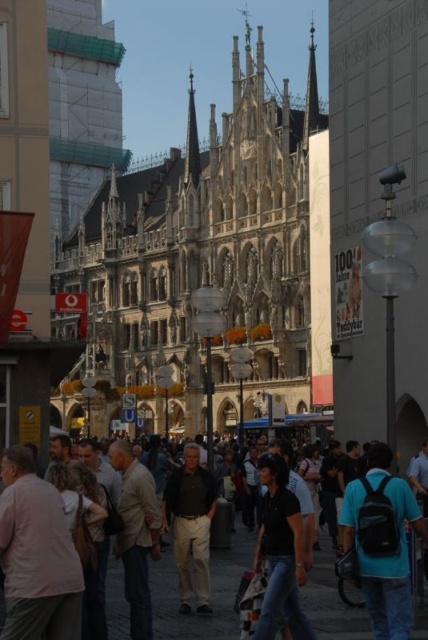
You are standing on the street in front of the Gothic building. You see a black cotton shirt at center and a light beige jacket at center. How far apart are these two clothing items?

The black cotton shirt at center is 7.44 meters away from the light beige jacket at center.

You are a photographer trying to capture both the light beige jacket at center and the dark gray shirt at center in the same frame. Since you want both to be clearly visible, which one should you focus on first to ensure the larger subject is in sharp focus?

The light beige jacket at center is bigger than the dark gray shirt at center, so you should focus on the light beige jacket at center first to ensure it is in sharp focus before adjusting for the smaller subject.

You are a photographer trying to capture a candid shot of the dark gray shirt at center without including the light beige jacket at center in the frame. Is this possible given their positions?

The light beige jacket at center is positioned over the dark gray shirt at center, so it would block the view. Therefore, it is not possible to capture the dark gray shirt at center without including the light beige jacket at center in the frame.